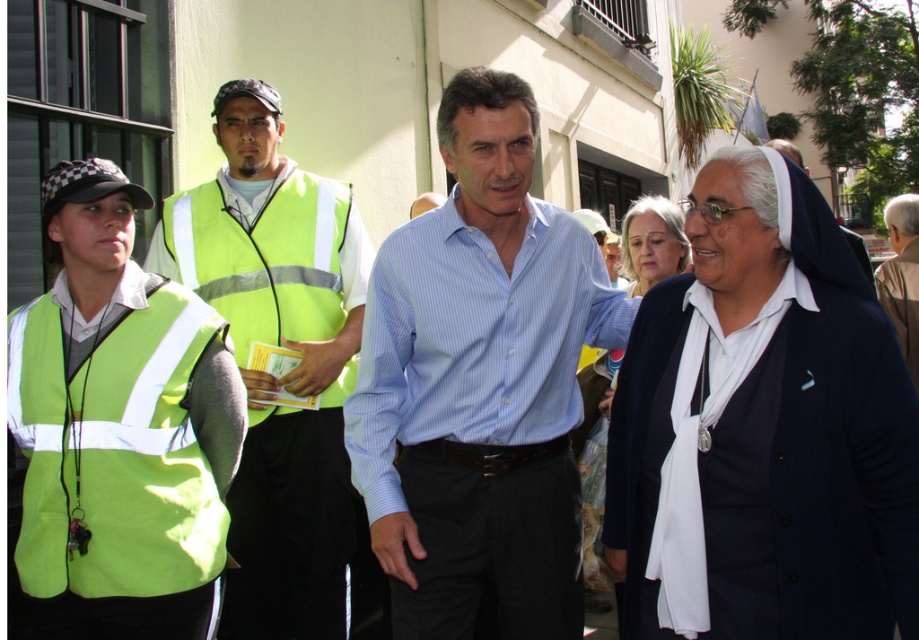
Question: Is blue striped shirt at center wider than brown leather jacket at upper right?

Choices:
 (A) no
 (B) yes

Answer: (A)

Question: Which point is farther to the camera?

Choices:
 (A) high visibility fabric safety vest at left
 (B) brown leather jacket at upper right

Answer: (B)

Question: Which point is closer to the camera?

Choices:
 (A) (328, 212)
 (B) (905, 240)

Answer: (A)

Question: Does white matte nun's habit at center appear under blue striped shirt at center?

Choices:
 (A) yes
 (B) no

Answer: (B)

Question: Does white matte nun's habit at center appear under high-visibility fabric safety vest at center?

Choices:
 (A) no
 (B) yes

Answer: (B)

Question: Which object is the farthest from the brown leather jacket at upper right?

Choices:
 (A) white matte nun's habit at center
 (B) high visibility vest at center

Answer: (B)